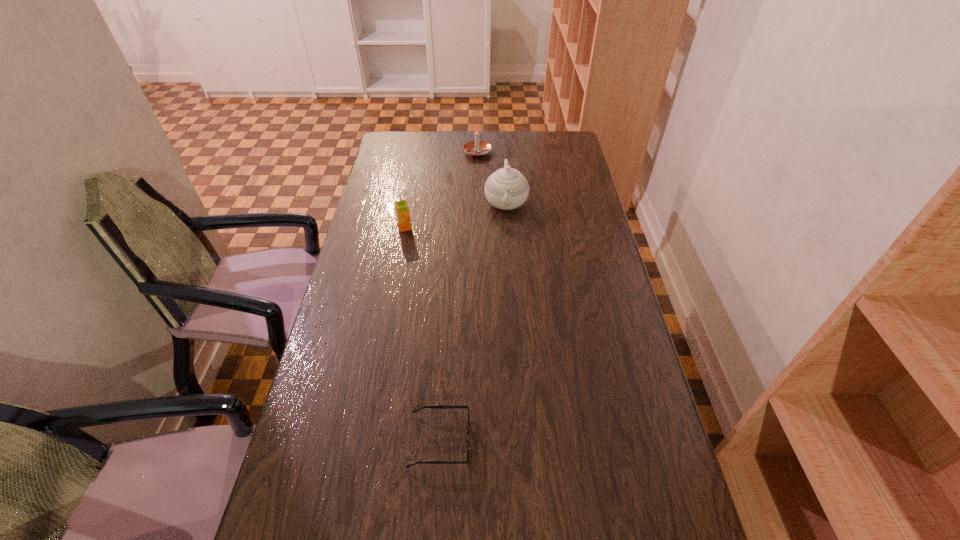
I want to click on free space located at the front lenses of the nearest object, so click(x=559, y=441).

Find the location of a particular element. object at the far edge is located at coordinates (477, 148).

The height and width of the screenshot is (540, 960). Identify the location of object that is at the left edge. (401, 207).

Where is `vacant region at the far edge`? The width and height of the screenshot is (960, 540). vacant region at the far edge is located at coordinates (454, 136).

At what (x,y) coordinates should I click in order to perform the action: click on vacant region at the left edge of the desktop. Please return your answer as a coordinate pair (x, y). The width and height of the screenshot is (960, 540). Looking at the image, I should click on (376, 341).

Find the location of a particular element. free space at the right edge of the desktop is located at coordinates (643, 379).

Image resolution: width=960 pixels, height=540 pixels. What are the coordinates of `free spot between the orange juice and the candle` in the screenshot? It's located at pyautogui.click(x=441, y=190).

This screenshot has width=960, height=540. In order to click on vacant space in between the sunglasses and the third nearest object in this screenshot , I will do `click(473, 321)`.

This screenshot has width=960, height=540. I want to click on free space between the leftmost object and the shortest object, so click(422, 334).

This screenshot has width=960, height=540. I want to click on free space between the leftmost object and the tallest object, so click(455, 215).